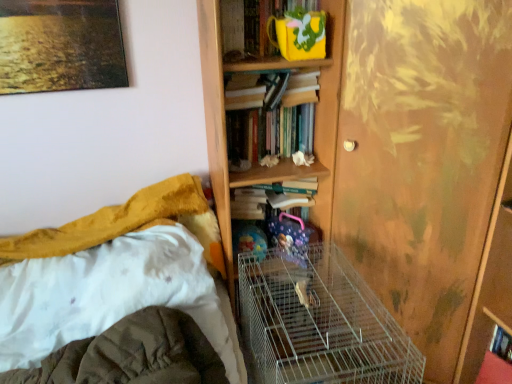
Question: Is point (251, 190) positioned closer to the camera than point (352, 107)?

Choices:
 (A) farther
 (B) closer

Answer: (A)

Question: Choose the correct answer: Is hardcover book at center, the first book positioned from the bottom, inside wooden screen door at right or outside it?

Choices:
 (A) outside
 (B) inside

Answer: (A)

Question: Considering the real-world distances, which object is farthest from the hardcover books at center, which ranks as the second book in top-to-bottom order?

Choices:
 (A) white soft blanket at lower left
 (B) wooden bookcase at upper center
 (C) yellow fabric book at upper center, acting as the 3th book starting from the bottom
 (D) wooden screen door at right
 (E) white fabric bed at lower left

Answer: (A)

Question: Based on their relative distances, which object is farther from the wooden screen door at right?

Choices:
 (A) hardcover book at center, the third book in the top-to-bottom sequence
 (B) yellow fabric book at upper center, which is the 1th book from top to bottom
 (C) hardcover books at center, which ranks as the second book in top-to-bottom order
 (D) wooden bookcase at upper center
 (E) white soft blanket at lower left

Answer: (E)